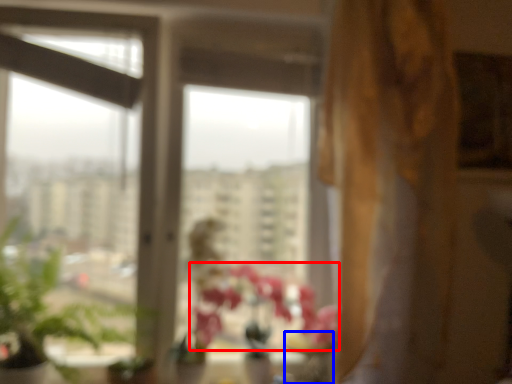
Question: Which object appears farthest to the camera in this image, flower (highlighted by a red box) or glass vase (highlighted by a blue box)?

Choices:
 (A) flower
 (B) glass vase

Answer: (B)